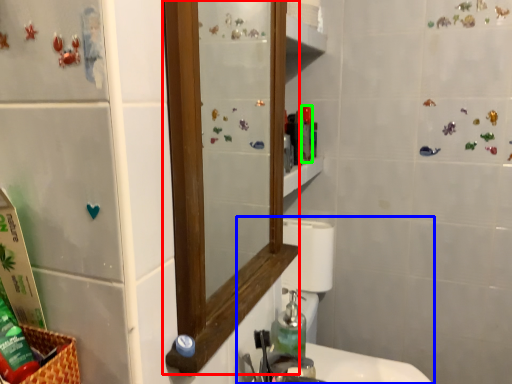
Question: Which is farther away from mirror (highlighted by a red box)? sink (highlighted by a blue box) or toiletry (highlighted by a green box)?

Choices:
 (A) sink
 (B) toiletry

Answer: (A)